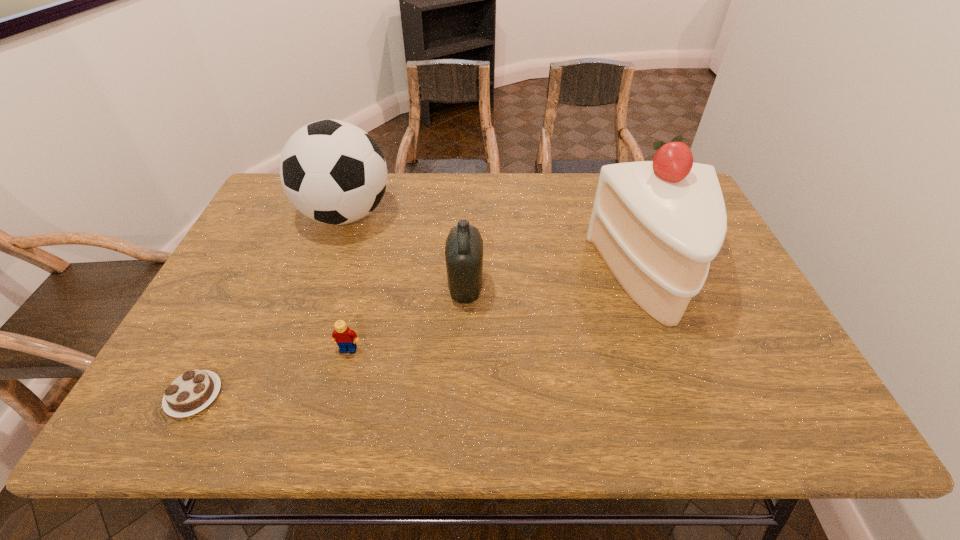
Identify the location of free space located on the front of the bottle. (462, 409).

The image size is (960, 540). In order to click on vacant space located 0.160m on the front-facing side of the fourth tallest object in this screenshot , I will do `click(330, 421)`.

You are a GUI agent. You are given a task and a screenshot of the screen. Output one action in this format:
    pyautogui.click(x=<x>, y=<y>)
    Task: Click on the vacant space situated 0.170m on the back of the nearest object
    The width and height of the screenshot is (960, 540).
    Given the screenshot: What is the action you would take?
    pyautogui.click(x=236, y=313)

Locate an element on the screen. The height and width of the screenshot is (540, 960). object that is at the far edge is located at coordinates (332, 171).

The image size is (960, 540). What are the coordinates of `object positioned at the near edge` in the screenshot? It's located at (191, 392).

Where is `soccer ball that is at the left edge`? The height and width of the screenshot is (540, 960). soccer ball that is at the left edge is located at coordinates (332, 171).

Locate an element on the screen. The image size is (960, 540). chocolate cake positioned at the left edge is located at coordinates (191, 392).

Locate an element on the screen. This screenshot has height=540, width=960. object situated at the right edge is located at coordinates (657, 224).

Image resolution: width=960 pixels, height=540 pixels. I want to click on object positioned at the far left corner, so click(x=332, y=171).

Locate an element on the screen. The width and height of the screenshot is (960, 540). object that is at the near left corner is located at coordinates (191, 392).